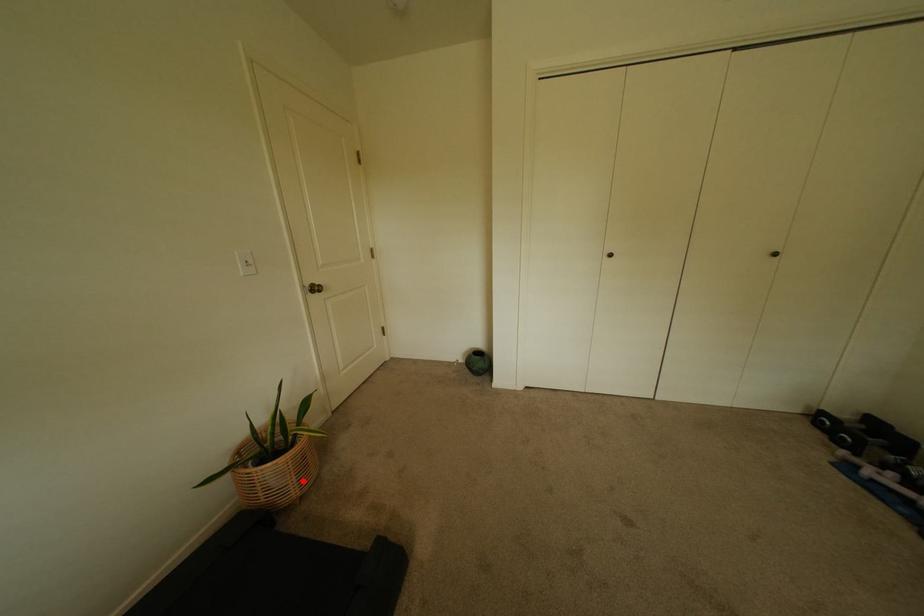
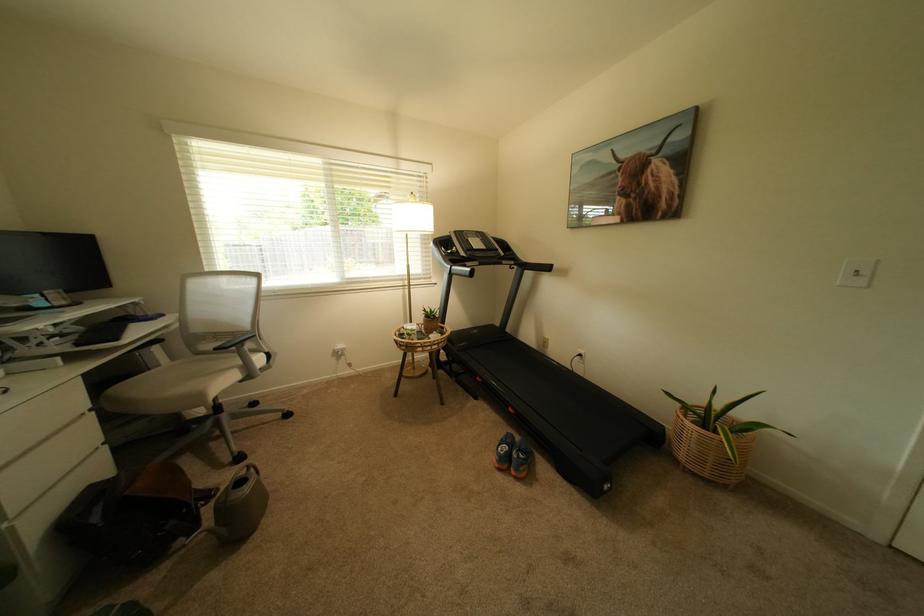
Question: I am providing you with two images of the same scene from different viewpoints. Given a red point in image1, look at the same physical point in image2. Is it:

Choices:
 (A) Closer to the viewpoint
 (B) Farther from the viewpoint

Answer: (B)